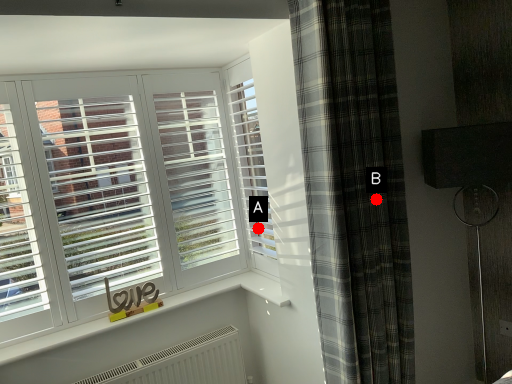
Question: Two points are circled on the image, labeled by A and B beside each circle. Which point is further to the camera?

Choices:
 (A) A is further
 (B) B is further

Answer: (A)